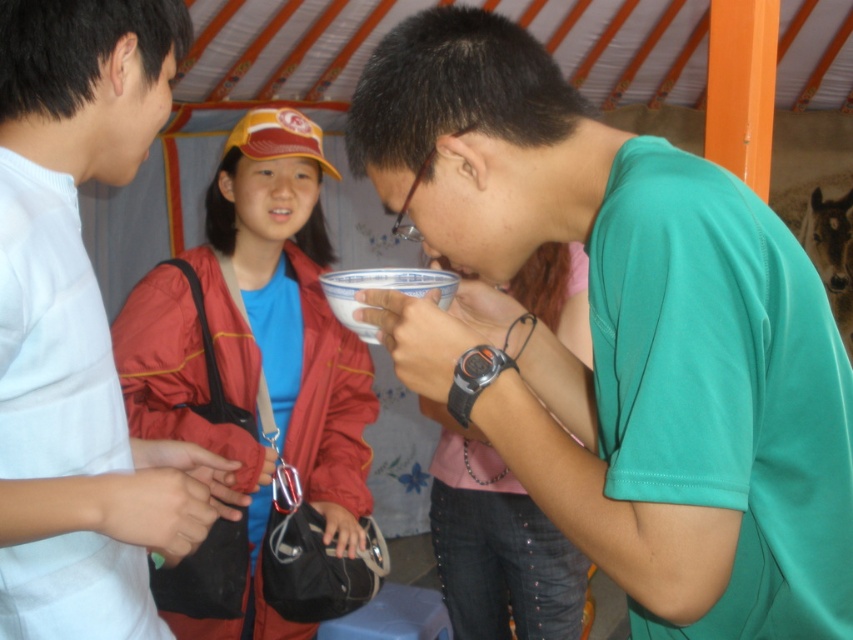
Is matte green t-shirt at center positioned behind matte red jacket at center?

No, matte green t-shirt at center is in front of matte red jacket at center.

Is point (469, 320) farther from camera compared to point (157, 321)?

No.

Find the location of a particular element. This screenshot has width=853, height=640. matte green t-shirt at center is located at coordinates (619, 336).

The image size is (853, 640). I want to click on matte green t-shirt at center, so click(x=619, y=336).